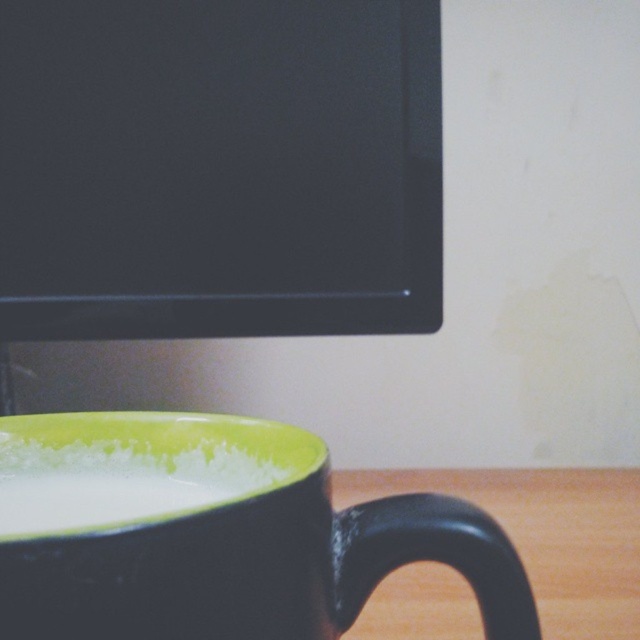
Can you confirm if matte black monitor at upper left is positioned below white frothy milk at lower left?

Actually, matte black monitor at upper left is above white frothy milk at lower left.

The height and width of the screenshot is (640, 640). Identify the location of matte black monitor at upper left. (218, 168).

Based on the photo, is green matte mug at lower left bigger than white frothy milk at lower left?

Indeed, green matte mug at lower left has a larger size compared to white frothy milk at lower left.

Can you confirm if green matte mug at lower left is positioned below white frothy milk at lower left?

Yes.

Who is more distant from viewer, (72, 518) or (38, 452)?

Positioned behind is point (38, 452).

I want to click on green matte mug at lower left, so click(x=214, y=532).

Is point (381, 285) farther from viewer compared to point (120, 460)?

Yes, point (381, 285) is farther from viewer.

Does matte black monitor at upper left have a smaller size compared to green matte mug at lower left?

Indeed, matte black monitor at upper left has a smaller size compared to green matte mug at lower left.

Who is more forward, (348, 294) or (244, 540)?

Point (244, 540)

Image resolution: width=640 pixels, height=640 pixels. I want to click on matte black monitor at upper left, so click(x=218, y=168).